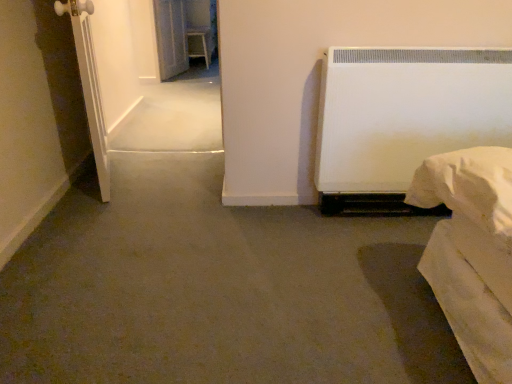
Locate an element on the screen. The image size is (512, 384). white matte screen door at left, which appears as the second screen door when viewed from the back is located at coordinates (89, 84).

This screenshot has height=384, width=512. Describe the element at coordinates (89, 84) in the screenshot. I see `white matte screen door at left, placed as the first screen door when sorted from front to back` at that location.

This screenshot has width=512, height=384. Find the location of `transparent glass screen door at upper left, which is the 1th screen door from back to front`. transparent glass screen door at upper left, which is the 1th screen door from back to front is located at coordinates (170, 37).

This screenshot has width=512, height=384. What do you see at coordinates (170, 37) in the screenshot?
I see `transparent glass screen door at upper left, which is the 1th screen door from back to front` at bounding box center [170, 37].

Find the location of a particular element. The height and width of the screenshot is (384, 512). white matte screen door at left, placed as the first screen door when sorted from front to back is located at coordinates (89, 84).

Considering the relative positions of white matte screen door at left, the second screen door when ordered from top to bottom, and transparent glass screen door at upper left, positioned as the second screen door in front-to-back order, in the image provided, is white matte screen door at left, the second screen door when ordered from top to bottom, to the left or to the right of transparent glass screen door at upper left, positioned as the second screen door in front-to-back order,?

white matte screen door at left, the second screen door when ordered from top to bottom, is to the right of transparent glass screen door at upper left, positioned as the second screen door in front-to-back order.

Which object is more forward, white matte screen door at left, which appears as the second screen door when viewed from the back, or transparent glass screen door at upper left, which appears as the second screen door when ordered from the bottom?

Positioned in front is white matte screen door at left, which appears as the second screen door when viewed from the back.

Does point (100, 160) appear closer or farther from the camera than point (177, 72)?

Point (100, 160) is positioned closer to the camera compared to point (177, 72).

From the image's perspective, relative to transparent glass screen door at upper left, positioned as the second screen door in front-to-back order, is white matte screen door at left, the second screen door when ordered from top to bottom, above or below?

white matte screen door at left, the second screen door when ordered from top to bottom, is below transparent glass screen door at upper left, positioned as the second screen door in front-to-back order.

From a real-world perspective, is white matte screen door at left, which appears as the second screen door when viewed from the back, over transparent glass screen door at upper left, which appears as the second screen door when ordered from the bottom?

Indeed, from a real-world perspective, white matte screen door at left, which appears as the second screen door when viewed from the back, stands above transparent glass screen door at upper left, which appears as the second screen door when ordered from the bottom.

Which object is thinner, white matte screen door at left, placed as the first screen door when sorted from front to back, or transparent glass screen door at upper left, which appears as the second screen door when ordered from the bottom?

With smaller width is transparent glass screen door at upper left, which appears as the second screen door when ordered from the bottom.

Is white matte screen door at left, which appears as the second screen door when viewed from the back, shorter than transparent glass screen door at upper left, the first screen door positioned from the top?

Incorrect, the height of white matte screen door at left, which appears as the second screen door when viewed from the back, does not fall short of that of transparent glass screen door at upper left, the first screen door positioned from the top.

Is white matte screen door at left, the second screen door when ordered from top to bottom, bigger or smaller than transparent glass screen door at upper left, which appears as the second screen door when ordered from the bottom?

Clearly, white matte screen door at left, the second screen door when ordered from top to bottom, is larger in size than transparent glass screen door at upper left, which appears as the second screen door when ordered from the bottom.

Which is correct: white matte screen door at left, the second screen door when ordered from top to bottom, is inside transparent glass screen door at upper left, positioned as the second screen door in front-to-back order, or outside of it?

white matte screen door at left, the second screen door when ordered from top to bottom, lies outside transparent glass screen door at upper left, positioned as the second screen door in front-to-back order.

Does white matte screen door at left, the second screen door when ordered from top to bottom, touch transparent glass screen door at upper left, positioned as the second screen door in front-to-back order?

white matte screen door at left, the second screen door when ordered from top to bottom, is not next to transparent glass screen door at upper left, positioned as the second screen door in front-to-back order, and they're not touching.

Could you tell me if white matte screen door at left, the second screen door when ordered from top to bottom, is turned towards transparent glass screen door at upper left, the first screen door positioned from the top?

No, white matte screen door at left, the second screen door when ordered from top to bottom, does not turn towards transparent glass screen door at upper left, the first screen door positioned from the top.

Can you tell me how much white matte screen door at left, placed as the first screen door when sorted from bottom to top, and transparent glass screen door at upper left, which is the 1th screen door from back to front, differ in facing direction?

33.2 degrees.

From the picture: How much distance is there between white matte screen door at left, placed as the first screen door when sorted from bottom to top, and transparent glass screen door at upper left, positioned as the second screen door in front-to-back order?

white matte screen door at left, placed as the first screen door when sorted from bottom to top, and transparent glass screen door at upper left, positioned as the second screen door in front-to-back order, are 8.94 feet apart.

In order to click on screen door that appears below the white matte screen door at left, which appears as the second screen door when viewed from the back (from a real-world perspective) in this screenshot , I will do `click(170, 37)`.

Between transparent glass screen door at upper left, the first screen door positioned from the top, and white matte screen door at left, placed as the first screen door when sorted from bottom to top, which one appears on the right side from the viewer's perspective?

white matte screen door at left, placed as the first screen door when sorted from bottom to top, is more to the right.

Which object is further away from the camera taking this photo, transparent glass screen door at upper left, the first screen door positioned from the top, or white matte screen door at left, placed as the first screen door when sorted from front to back?

transparent glass screen door at upper left, the first screen door positioned from the top, is further away from the camera.

Is point (178, 29) farther from viewer compared to point (89, 57)?

Yes, it is.

From the image's perspective, which object appears higher, transparent glass screen door at upper left, positioned as the second screen door in front-to-back order, or white matte screen door at left, which appears as the second screen door when viewed from the back?

transparent glass screen door at upper left, positioned as the second screen door in front-to-back order, is shown above in the image.

From a real-world perspective, is transparent glass screen door at upper left, which is the 1th screen door from back to front, physically above white matte screen door at left, placed as the first screen door when sorted from bottom to top?

Incorrect, from a real-world perspective, transparent glass screen door at upper left, which is the 1th screen door from back to front, is lower than white matte screen door at left, placed as the first screen door when sorted from bottom to top.

Between transparent glass screen door at upper left, positioned as the second screen door in front-to-back order, and white matte screen door at left, the second screen door when ordered from top to bottom, which one has smaller width?

With smaller width is transparent glass screen door at upper left, positioned as the second screen door in front-to-back order.

Between transparent glass screen door at upper left, the first screen door positioned from the top, and white matte screen door at left, placed as the first screen door when sorted from bottom to top, which one has more height?

With more height is white matte screen door at left, placed as the first screen door when sorted from bottom to top.

Between transparent glass screen door at upper left, positioned as the second screen door in front-to-back order, and white matte screen door at left, placed as the first screen door when sorted from front to back, which one has larger size?

Bigger between the two is white matte screen door at left, placed as the first screen door when sorted from front to back.

Is transparent glass screen door at upper left, the first screen door positioned from the top, outside of white matte screen door at left, placed as the first screen door when sorted from bottom to top?

That's correct, transparent glass screen door at upper left, the first screen door positioned from the top, is outside of white matte screen door at left, placed as the first screen door when sorted from bottom to top.

Would you consider transparent glass screen door at upper left, the first screen door positioned from the top, to be distant from white matte screen door at left, which appears as the second screen door when viewed from the back?

Absolutely, transparent glass screen door at upper left, the first screen door positioned from the top, is distant from white matte screen door at left, which appears as the second screen door when viewed from the back.

Is transparent glass screen door at upper left, which is the 1th screen door from back to front, facing away from white matte screen door at left, which appears as the second screen door when viewed from the back?

transparent glass screen door at upper left, which is the 1th screen door from back to front, does not have its back to white matte screen door at left, which appears as the second screen door when viewed from the back.

Can you tell me how much transparent glass screen door at upper left, which is the 1th screen door from back to front, and white matte screen door at left, which appears as the second screen door when viewed from the back, differ in facing direction?

The angle between the facing direction of transparent glass screen door at upper left, which is the 1th screen door from back to front, and the facing direction of white matte screen door at left, which appears as the second screen door when viewed from the back, is 33.2 degrees.

How far apart are transparent glass screen door at upper left, which appears as the second screen door when ordered from the bottom, and white matte screen door at left, placed as the first screen door when sorted from front to back?

A distance of 2.72 meters exists between transparent glass screen door at upper left, which appears as the second screen door when ordered from the bottom, and white matte screen door at left, placed as the first screen door when sorted from front to back.

Image resolution: width=512 pixels, height=384 pixels. In order to click on screen door located on the left of white matte screen door at left, which appears as the second screen door when viewed from the back in this screenshot , I will do `click(170, 37)`.

Image resolution: width=512 pixels, height=384 pixels. What are the coordinates of `screen door above the white matte screen door at left, the second screen door when ordered from top to bottom (from the image's perspective)` in the screenshot? It's located at (170, 37).

Find the location of a particular element. This screenshot has height=384, width=512. screen door above the transparent glass screen door at upper left, positioned as the second screen door in front-to-back order (from a real-world perspective) is located at coordinates (89, 84).